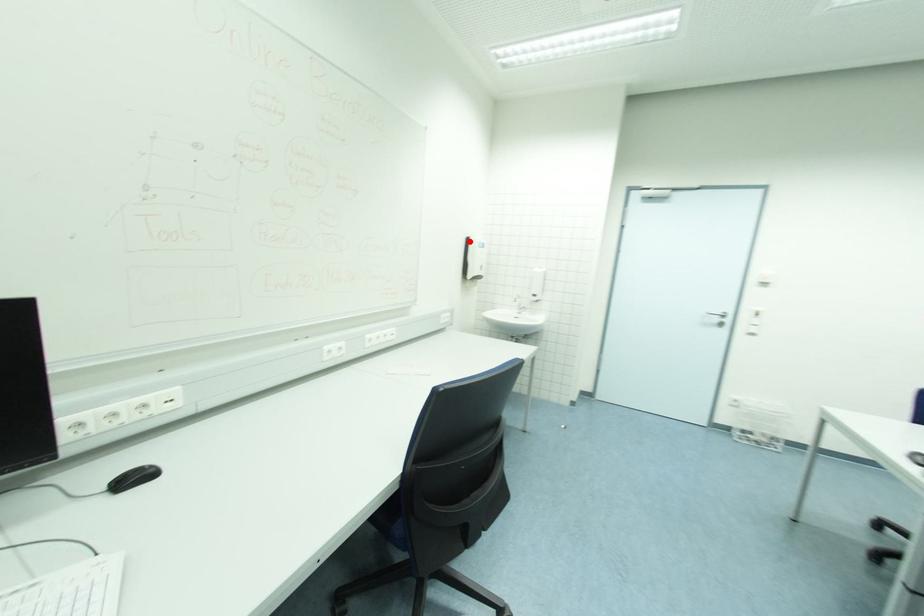
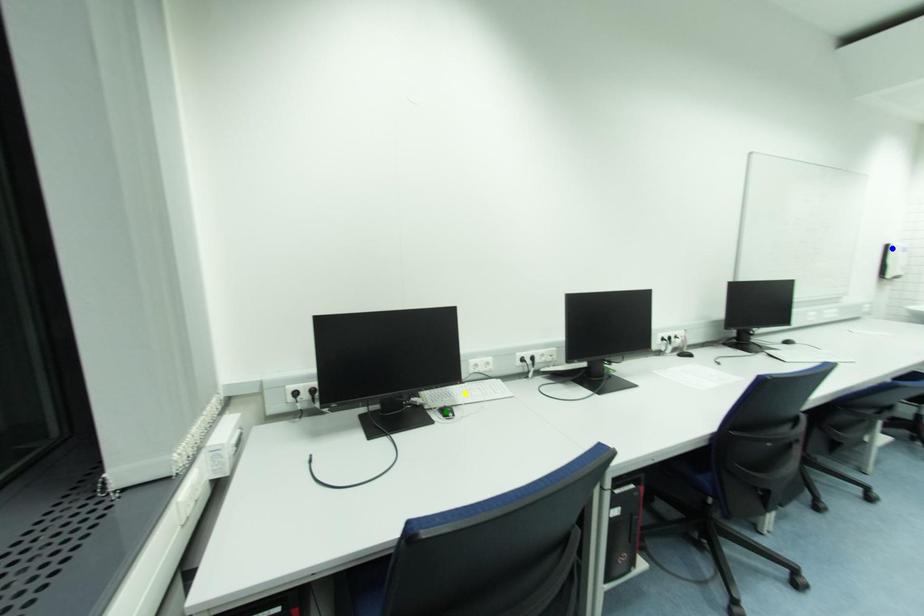
Question: I am providing you with two images of the same scene from different viewpoints. A red point is marked on the first image. You are given multiple points on the second image. Which point in image 2 is actually the same real-world point as the red point in image 1?

Choices:
 (A) yellow point
 (B) green point
 (C) blue point

Answer: (C)